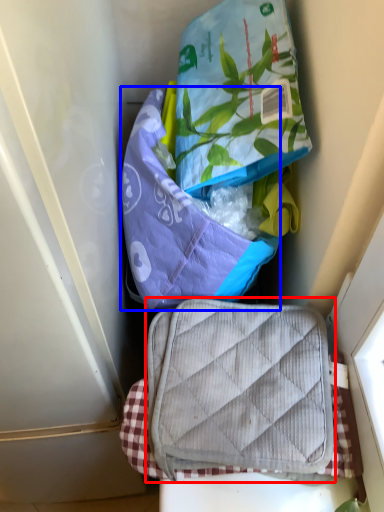
Question: Which object appears closest to the camera in this image, luggage and bags (highlighted by a red box) or pouch (highlighted by a blue box)?

Choices:
 (A) luggage and bags
 (B) pouch

Answer: (A)